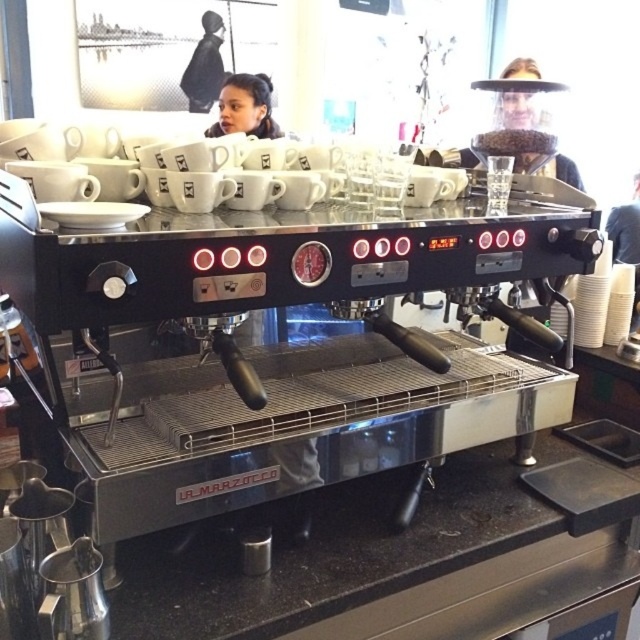
You are a barista preparing to clean the clear plastic face shield at upper center. You need to place it temporarily on the black granite countertop at lower center. Is there enough space for the shield to fit on the countertop without hanging over the edge?

The black granite countertop at lower center is positioned under the clear plastic face shield at upper center, but the description does not provide specific measurements about the size of the shield or the dimensions of the countertop. Therefore, it is uncertain if there is enough space for the shield to fit without hanging over the edge.

You are a barista preparing to clean the clear plastic face shield at upper center and the black granite countertop at lower center. Which object should you clean first if you want to start from the leftmost item?

The black granite countertop at lower center is on the left side of the clear plastic face shield at upper center, so you should clean the black granite countertop at lower center first.

You are a barista preparing to clean the black granite countertop at lower center and the clear plastic face shield at upper center. Which surface requires more cleaning effort due to its size?

The black granite countertop at lower center requires more cleaning effort because it is bigger than the clear plastic face shield at upper center.